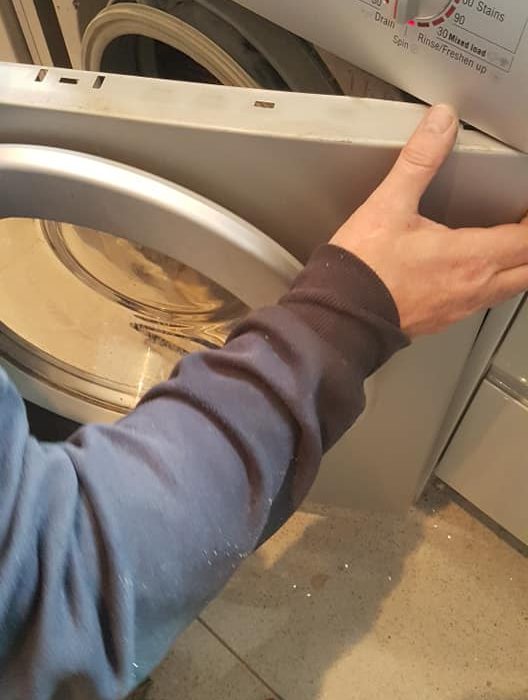
Identify the location of door holes for locking. This screenshot has width=528, height=700. (97, 89), (64, 87), (36, 84), (264, 111).